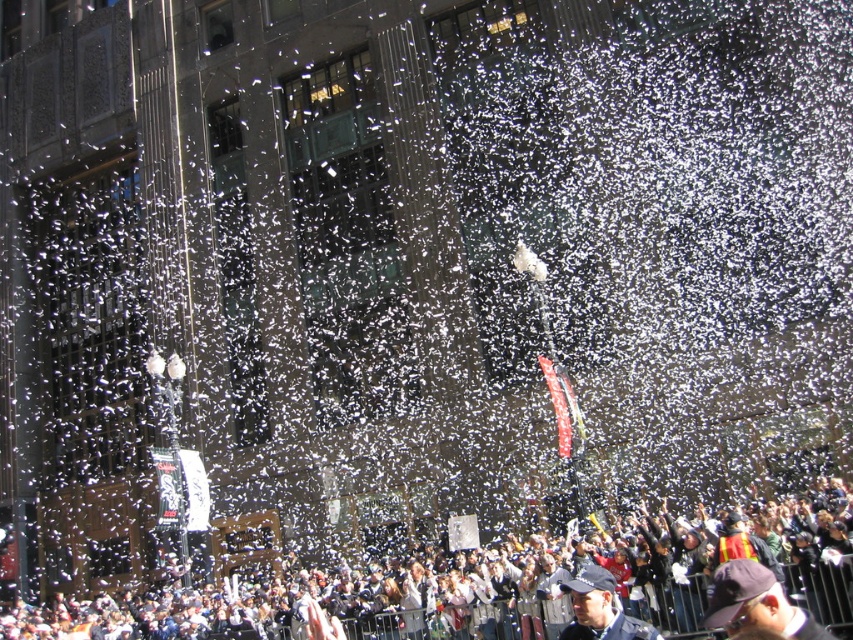
You are a photographer standing at the edge of the crowd. You want to capture a photo that includes both the dark blue fabric cap at lower right and the blue fabric cap at lower center. Given that your camera has a maximum zoom range of 10 meters, will you be able to fit both caps in the frame without moving closer?

The distance between the dark blue fabric cap at lower right and the blue fabric cap at lower center is 8.75 meters. Since your camera can zoom up to 10 meters, you can fit both caps in the frame without moving closer.

You are a photographer at the event and want to capture a photo that includes both the white paper confetti at lower center and the dark blue fabric cap at lower right. Based on their positions, which object appears taller in the frame?

The white paper confetti at lower center appears taller in the frame because it has a greater height compared to the dark blue fabric cap at lower right.

You are standing at the origin of a coordinate system in this scene. There are two points marked in the image, one at point (x=624, y=532) and another at point (x=741, y=584). Which point is closer to you?

Point (x=741, y=584) is closer to you because it is in front of point (x=624, y=532).